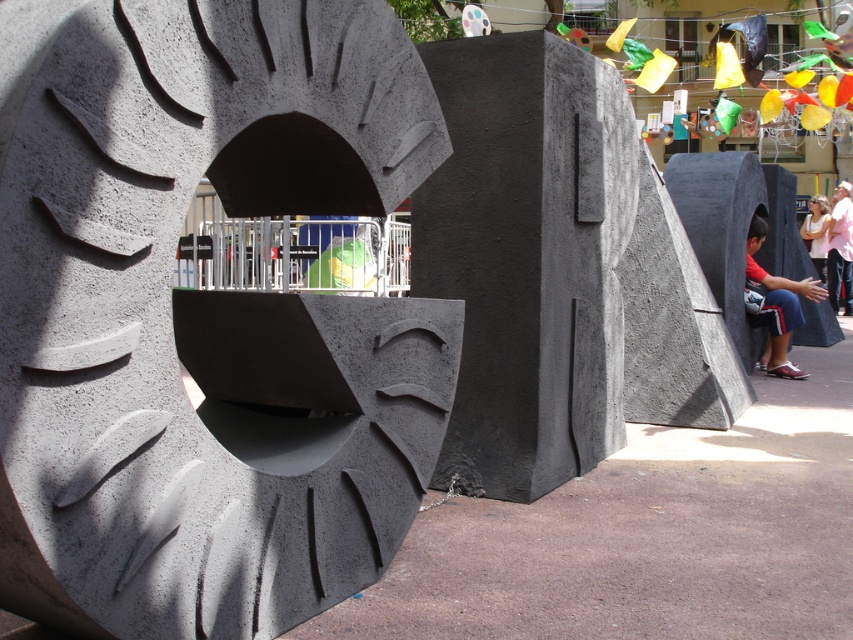
Does point (82, 577) come farther from viewer compared to point (770, 369)?

No, it is not.

Does point (308, 355) lie behind point (798, 369)?

No, (308, 355) is in front of (798, 369).

Find the location of a particular element. The width and height of the screenshot is (853, 640). matte gray tire at center is located at coordinates (204, 316).

Does matte gray tire at center appear under white shirt at lower right?

Indeed, matte gray tire at center is positioned under white shirt at lower right.

Who is more forward, [361,163] or [845,250]?

Point [361,163]

Identify the location of matte gray tire at center. (204, 316).

Does point (814, 221) come in front of point (811, 198)?

Yes, point (814, 221) is in front of point (811, 198).

Does pink fabric at upper right appear on the left side of matte black face at center?

In fact, pink fabric at upper right is to the right of matte black face at center.

Does point (808, 236) come farther from viewer compared to point (809, 204)?

No, (808, 236) is closer to viewer.

Where is `pink fabric at upper right`? Image resolution: width=853 pixels, height=640 pixels. pink fabric at upper right is located at coordinates (816, 232).